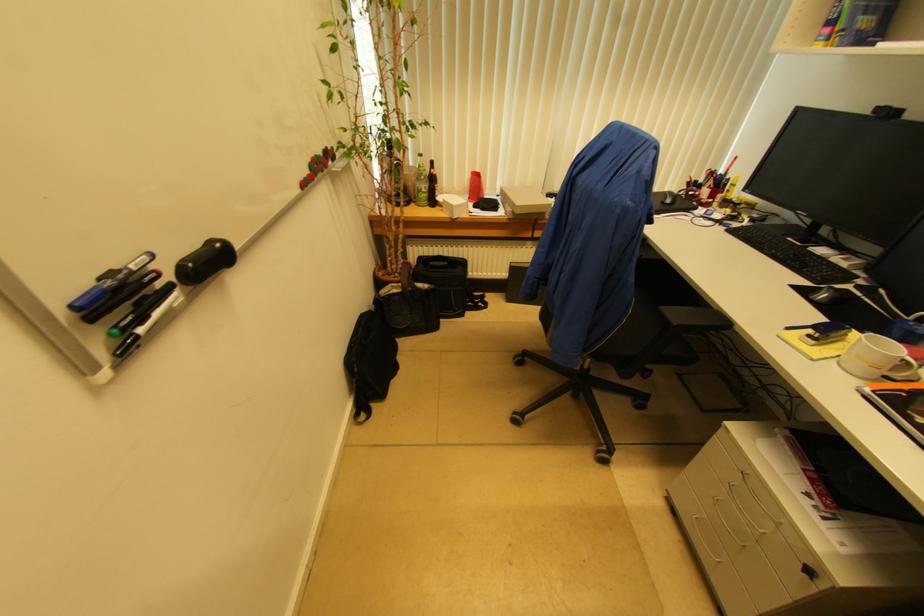
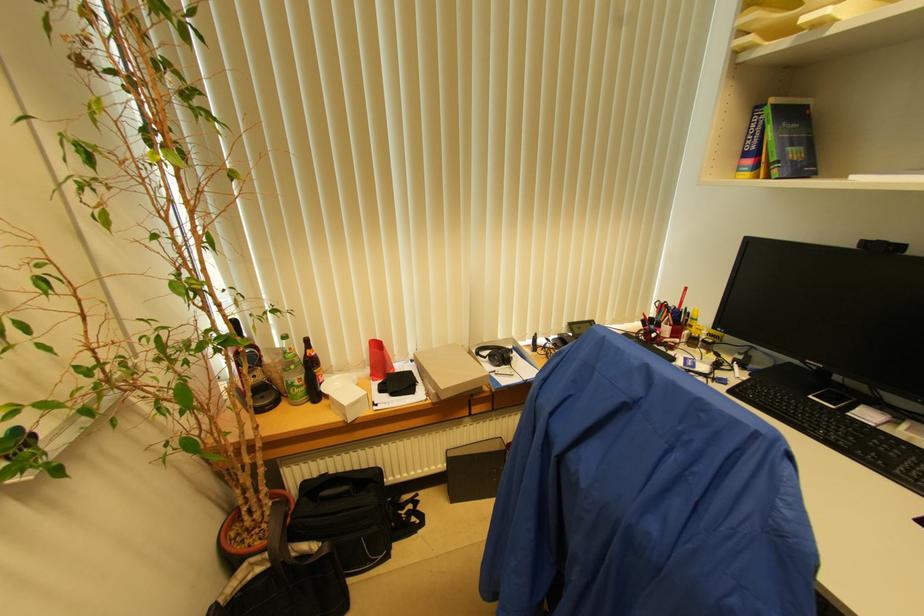
Where in the second image is the point corresponding to (844,34) from the first image?

(780, 166)